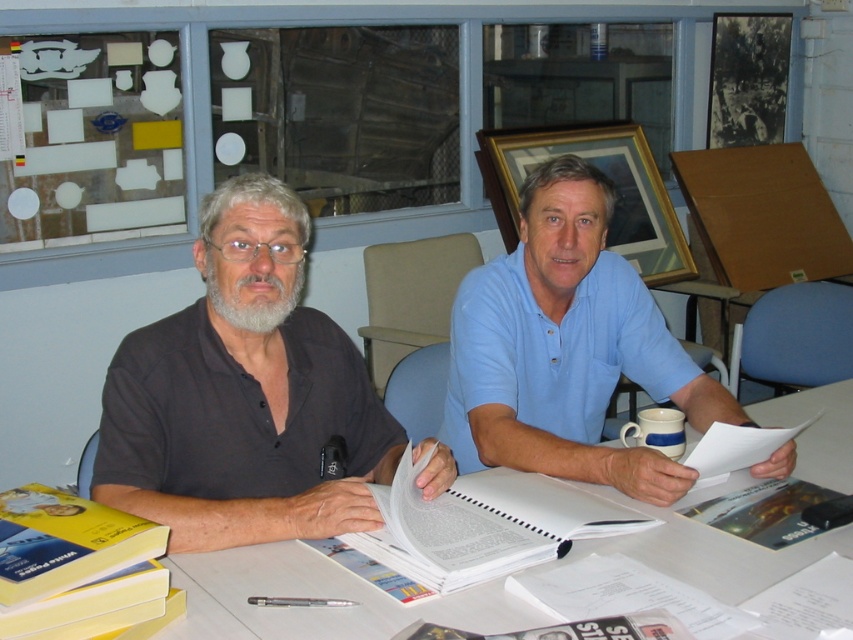
Does dark gray shirt at left have a lesser height compared to white paper book at center?

Incorrect, dark gray shirt at left's height does not fall short of white paper book at center's.

Does dark gray shirt at left come in front of white paper book at center?

That is False.

This screenshot has width=853, height=640. What do you see at coordinates (242, 394) in the screenshot? I see `dark gray shirt at left` at bounding box center [242, 394].

Where is `dark gray shirt at left`? dark gray shirt at left is located at coordinates (242, 394).

Does dark gray shirt at center have a larger size compared to dark gray shirt at left?

Yes, dark gray shirt at center is bigger than dark gray shirt at left.

Is dark gray shirt at center wider than dark gray shirt at left?

Yes, dark gray shirt at center is wider than dark gray shirt at left.

Which is in front, point (312, 490) or point (314, 368)?

Point (312, 490) is more forward.

What are the coordinates of `dark gray shirt at center` in the screenshot? It's located at (248, 397).

Is yellow paper book at lower left below matte plastic book at center?

Actually, yellow paper book at lower left is above matte plastic book at center.

Can you confirm if yellow paper book at lower left is bigger than matte plastic book at center?

Indeed, yellow paper book at lower left has a larger size compared to matte plastic book at center.

At what (x,y) coordinates should I click in order to perform the action: click on yellow paper book at lower left. Please return your answer as a coordinate pair (x, y). Looking at the image, I should click on (65, 541).